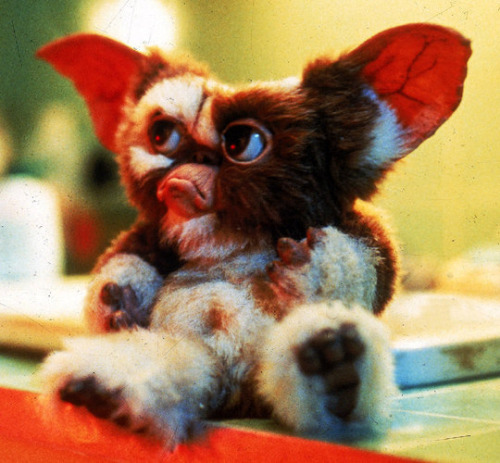
Where is `chest`? The image size is (500, 463). chest is located at coordinates tap(211, 313).